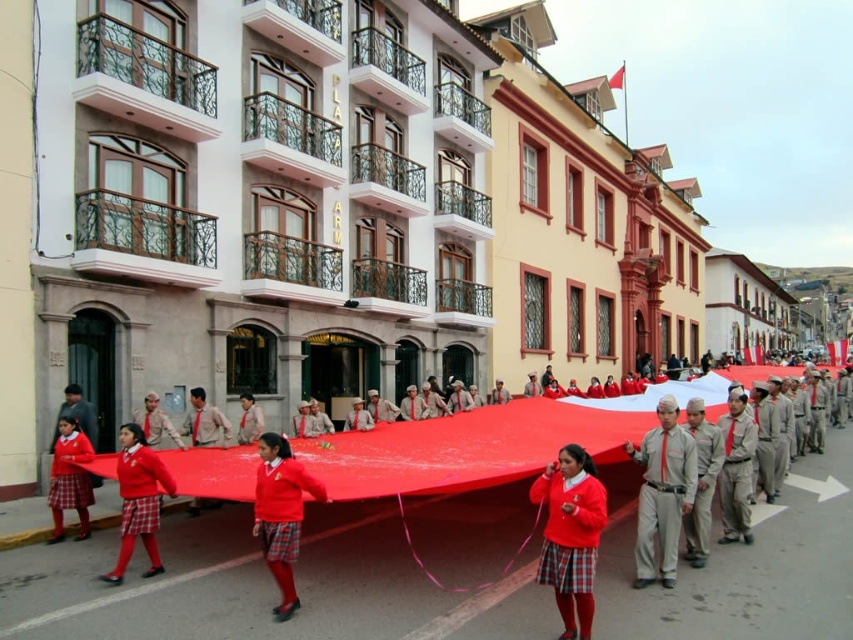
What is located at the coordinates point [570,536]?

The point [570,536] is occupied by a matte red sweater at center.

You are a photographer taking a picture of the matte red sweater at center and the matte khaki uniform at center. Which one should you focus on first if you want to capture both in the frame without moving the camera?

The matte khaki uniform at center should be focused on first because it is to the left of the matte red sweater at center, allowing the photographer to adjust the focus from left to right to include both in the frame.

You are a photographer trying to capture a photo of the light gray cotton pants at center and the red plaid skirt at lower left. Which object should you focus on first if you want to ensure both are in focus without adjusting your camera settings?

The light gray cotton pants at center is taller than the red plaid skirt at lower left, so focusing on the light gray cotton pants at center first would ensure both are in focus since it is farther away and has a larger depth of field.